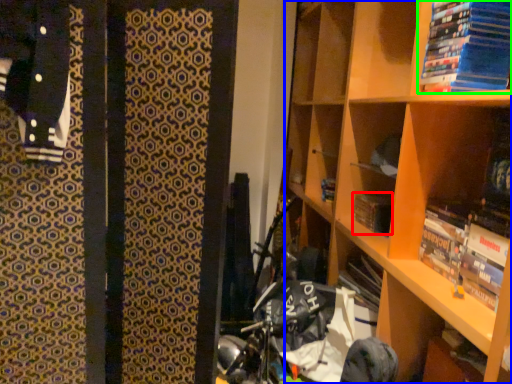
Question: Which is farther away from paperback book (highlighted by a red box)? shelf (highlighted by a blue box) or book (highlighted by a green box)?

Choices:
 (A) shelf
 (B) book

Answer: (B)